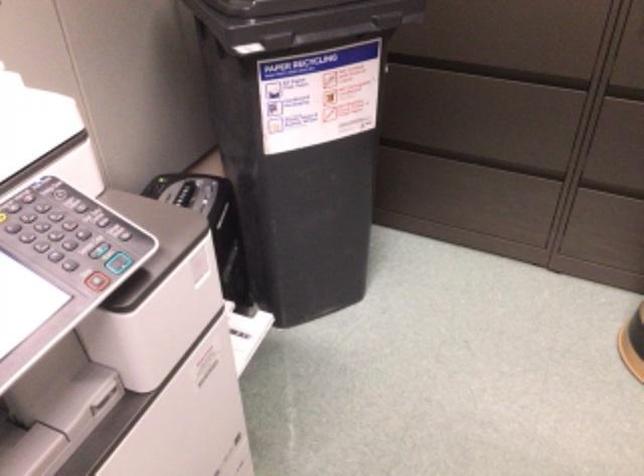
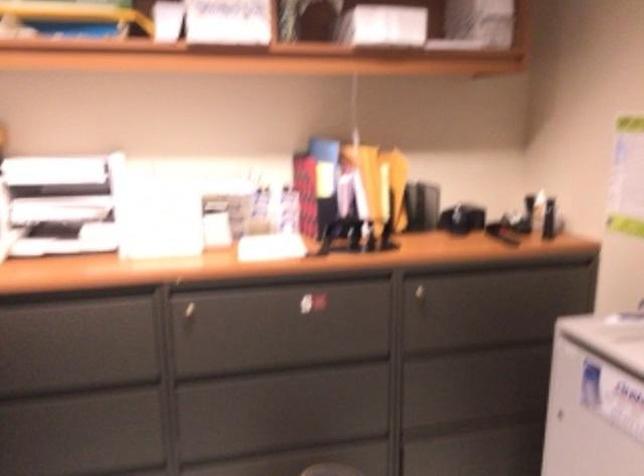
First-person continuous shooting, in which direction is the camera rotating?

The camera rotated toward right-up.